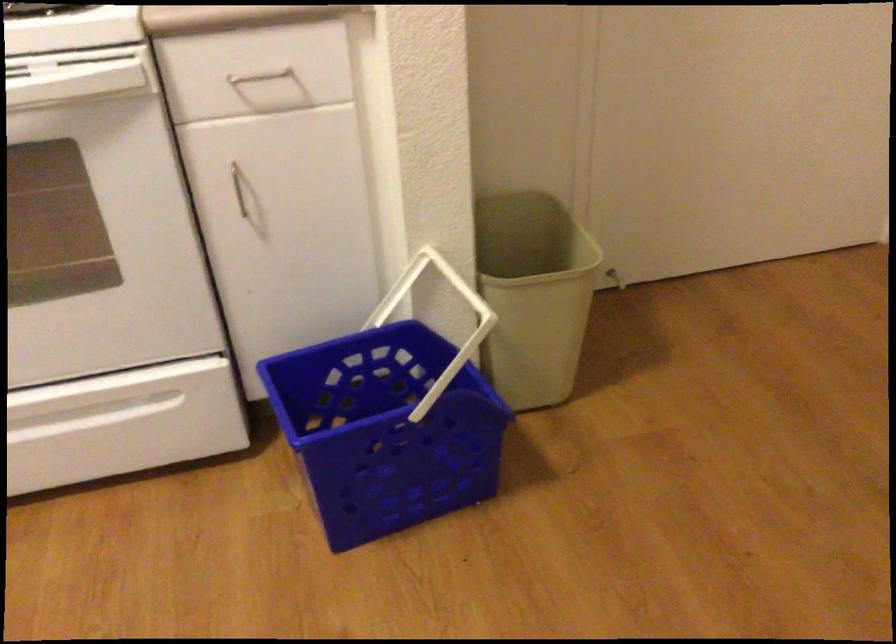
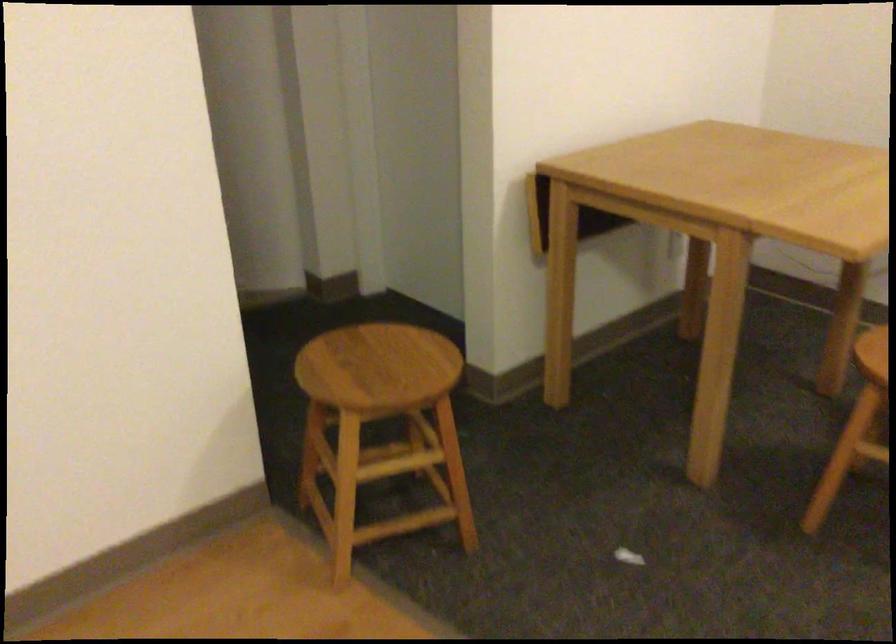
Based on the continuous images, in which direction is the camera rotating?

The camera rotated toward right-down.